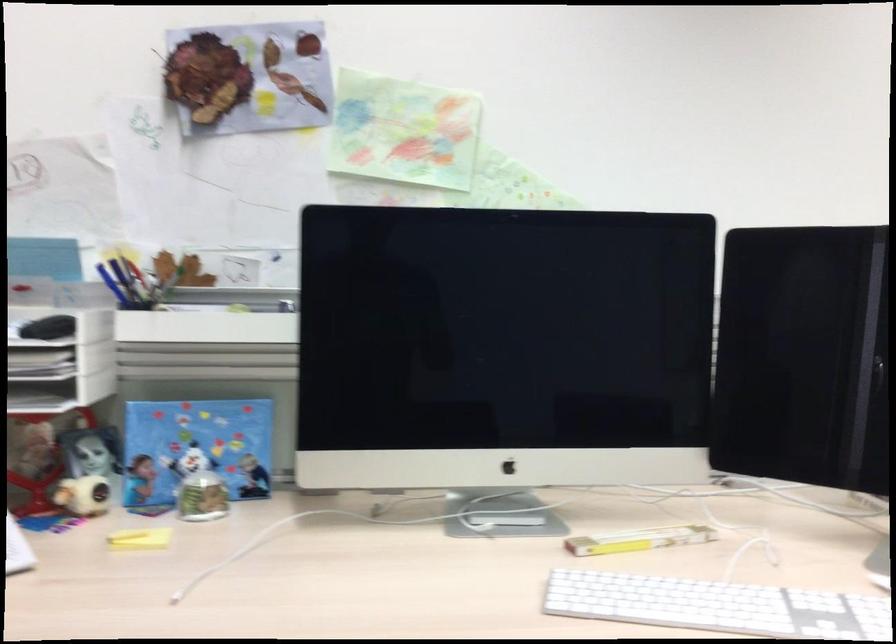
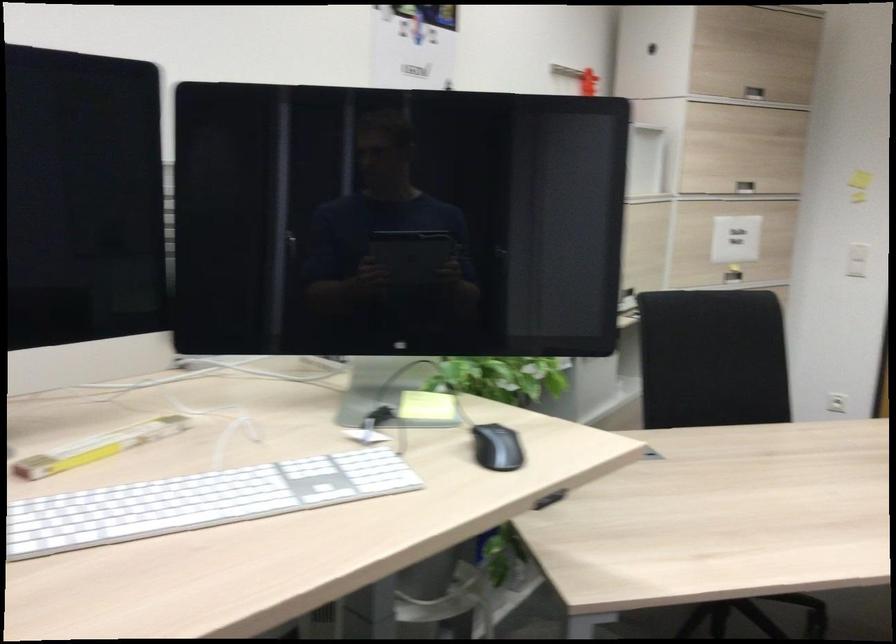
Locate, in the second image, the point that corresponds to the point at 633,536 in the first image.

(98, 447)